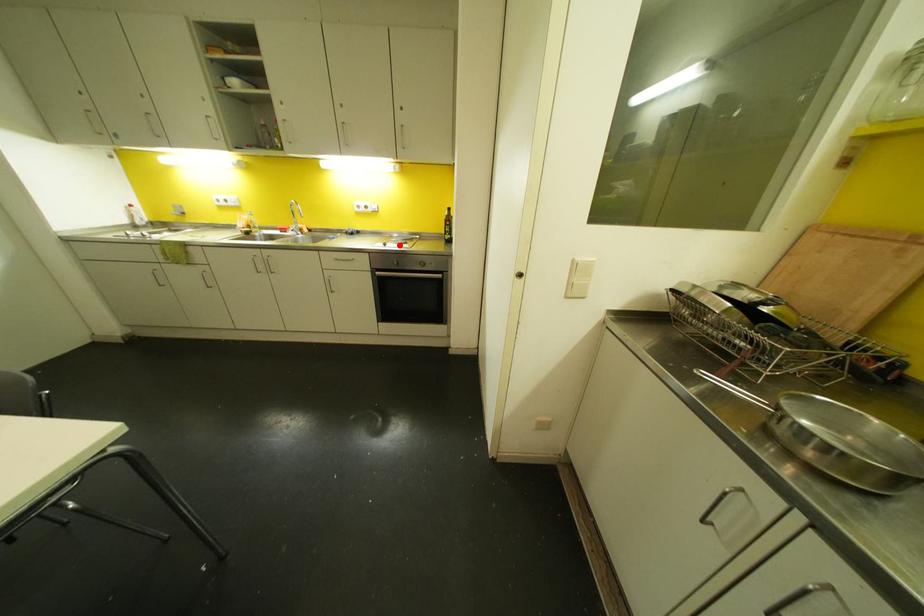
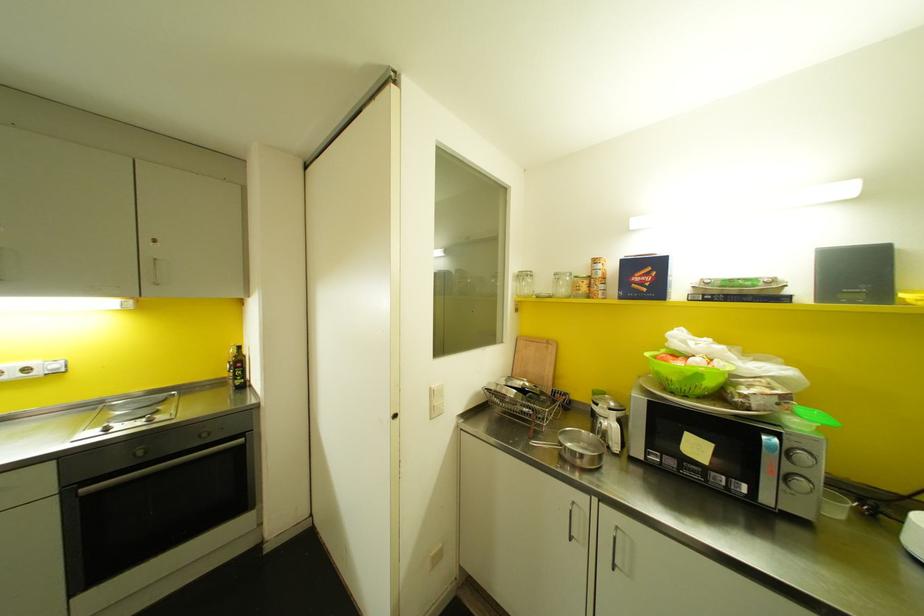
Question: A red point is marked in image1. In image2, is the corresponding 3D point closer to the camera or farther? Reply with the corresponding letter.

Choices:
 (A) The corresponding 3D point is closer.
 (B) The corresponding 3D point is farther.

Answer: (B)